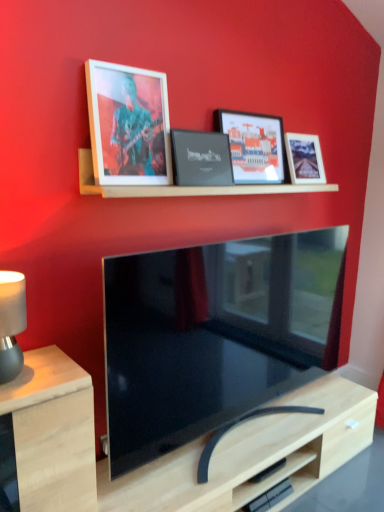
The image size is (384, 512). I want to click on unoccupied region to the right of matte black lampshade at left, so click(x=54, y=373).